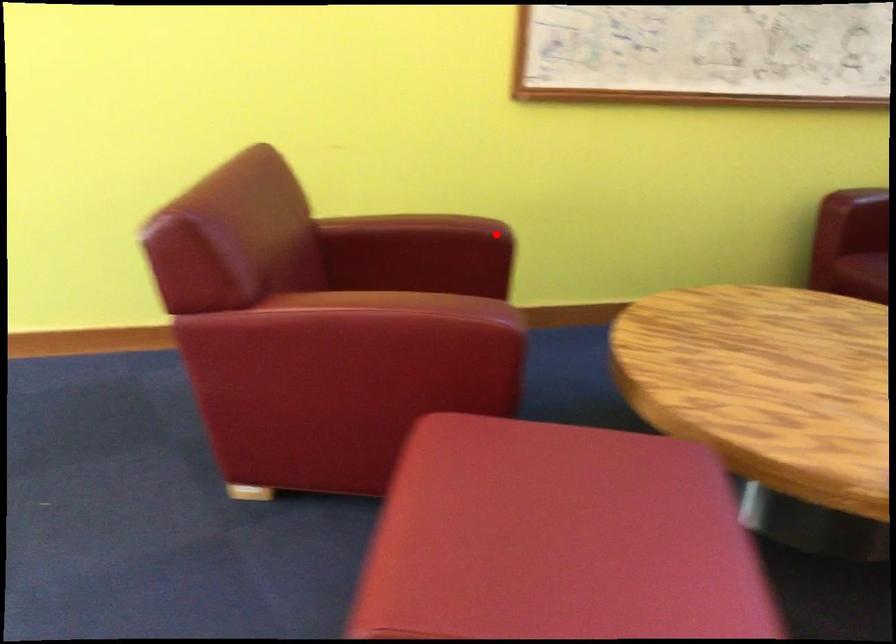
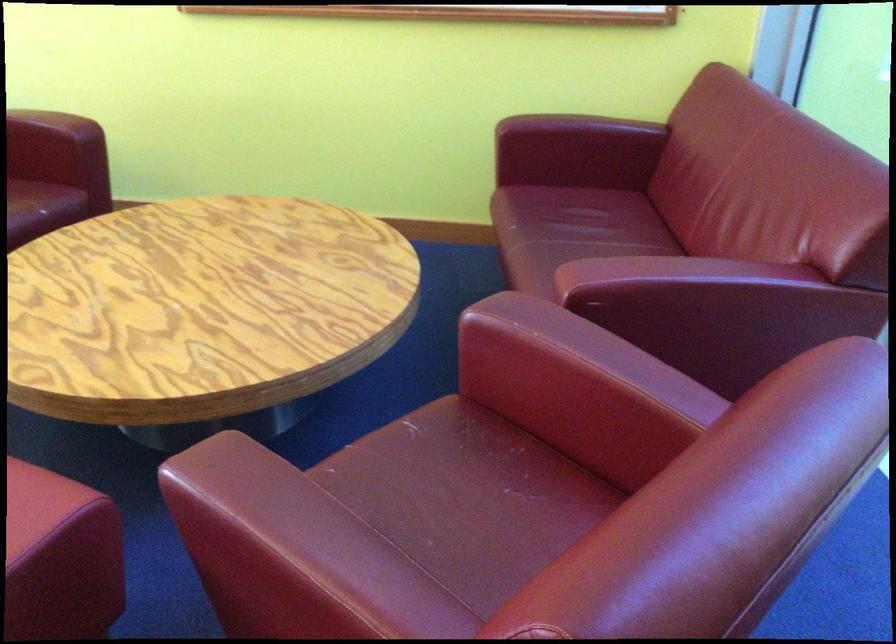
Question: I am providing you with two images of the same scene from different viewpoints. Image1 has a red point marked. In image2, the corresponding 3D location appears at what relative position? Reply with the corresponding letter.

Choices:
 (A) Closer
 (B) Farther

Answer: (B)